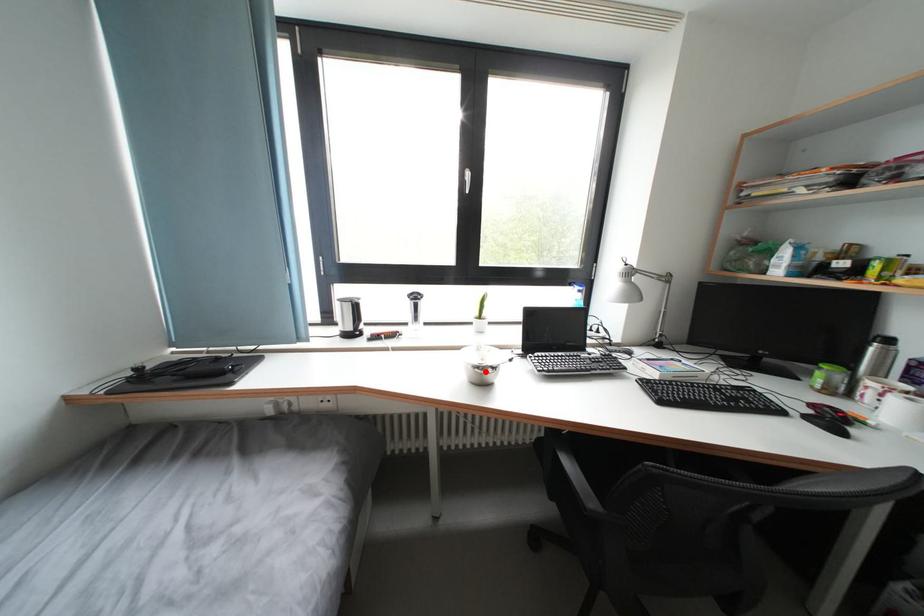
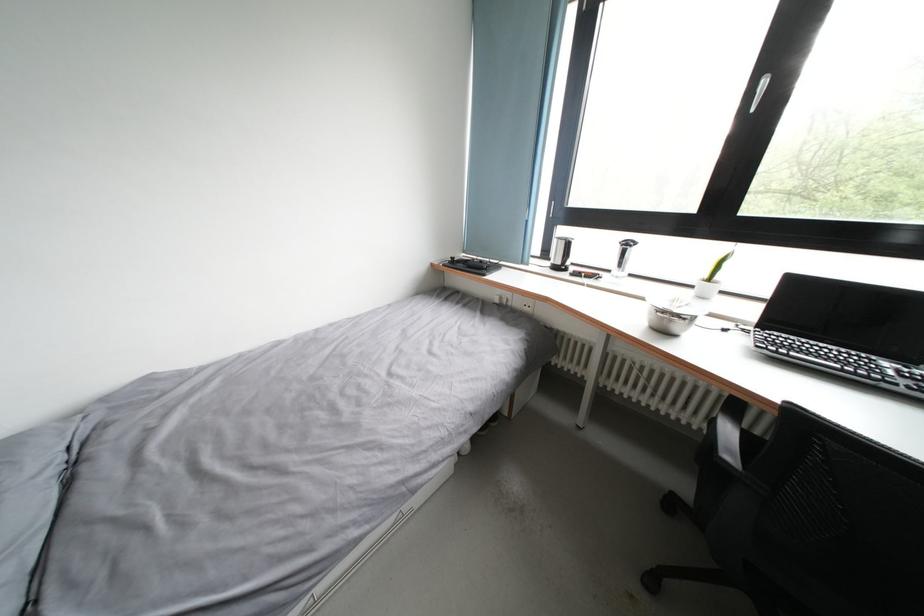
Question: I am providing you with two images of the same scene from different viewpoints. A red point is shown in image1. For the corresponding object point in image2, is it positioned nearer or farther from the camera?

Choices:
 (A) Nearer
 (B) Farther

Answer: (A)